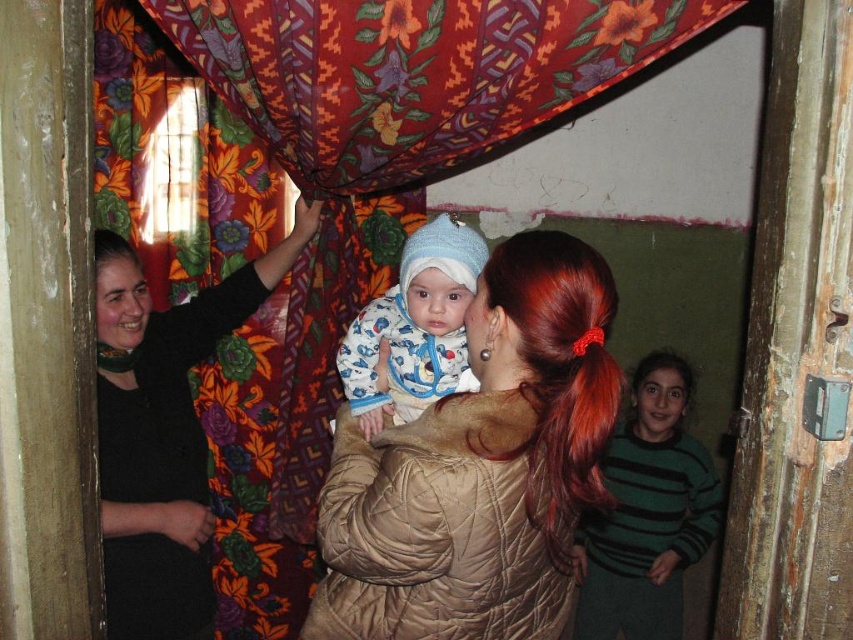
Based on the photo, can you confirm if matte brown coat at center is bigger than knitted blue hat at center?

Yes, matte brown coat at center is bigger than knitted blue hat at center.

Is point (447, 440) more distant than point (369, 406)?

No, it is in front of (369, 406).

You are a GUI agent. You are given a task and a screenshot of the screen. Output one action in this format:
    pyautogui.click(x=<x>, y=<y>)
    Task: Click on the matte brown coat at center
    Image resolution: width=853 pixels, height=640 pixels.
    Given the screenshot: What is the action you would take?
    tap(480, 467)

Who is more distant from viewer, (115,440) or (350,397)?

Point (115,440)

Does black fabric at left have a smaller size compared to knitted blue hat at center?

Actually, black fabric at left might be larger than knitted blue hat at center.

Does point (206, 316) come in front of point (438, 337)?

No, (206, 316) is behind (438, 337).

Where is `black fabric at left`? The image size is (853, 640). black fabric at left is located at coordinates (163, 433).

Can you confirm if matte brown coat at center is taller than green striped sweater at right?

No.

Is matte brown coat at center above green striped sweater at right?

Correct, matte brown coat at center is located above green striped sweater at right.

You are a GUI agent. You are given a task and a screenshot of the screen. Output one action in this format:
    pyautogui.click(x=<x>, y=<y>)
    Task: Click on the matte brown coat at center
    
    Given the screenshot: What is the action you would take?
    pyautogui.click(x=480, y=467)

The height and width of the screenshot is (640, 853). Identify the location of matte brown coat at center. (480, 467).